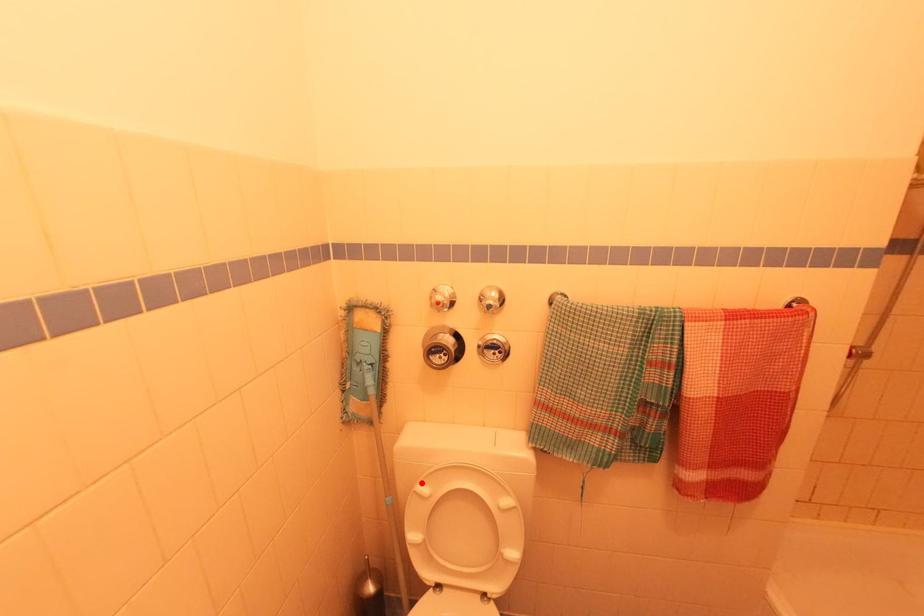
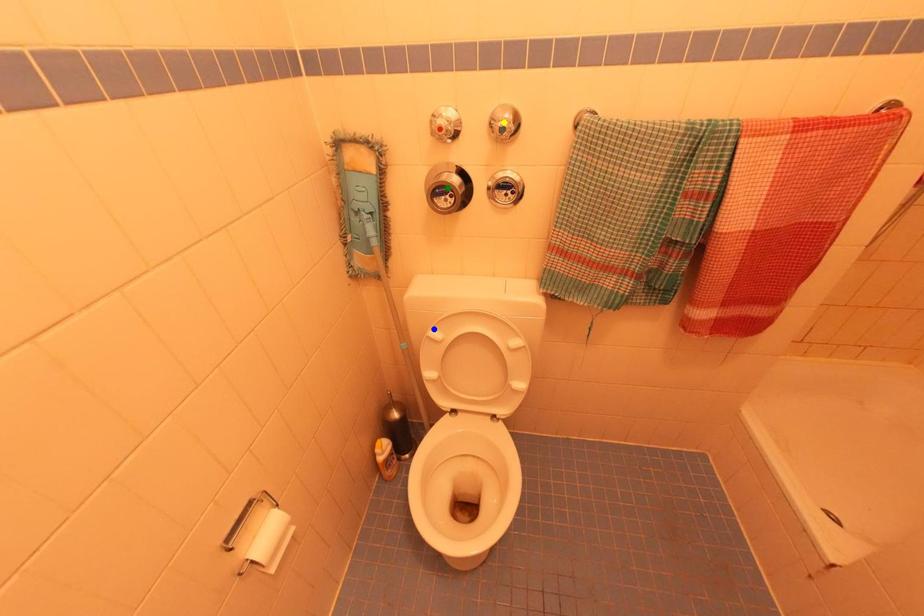
Question: I am providing you with two images of the same scene from different viewpoints. A red point is marked on the first image. You are given multiple points on the second image. In image 2, which mark is for the same physical point as the one in image 1?

Choices:
 (A) green point
 (B) blue point
 (C) yellow point

Answer: (B)